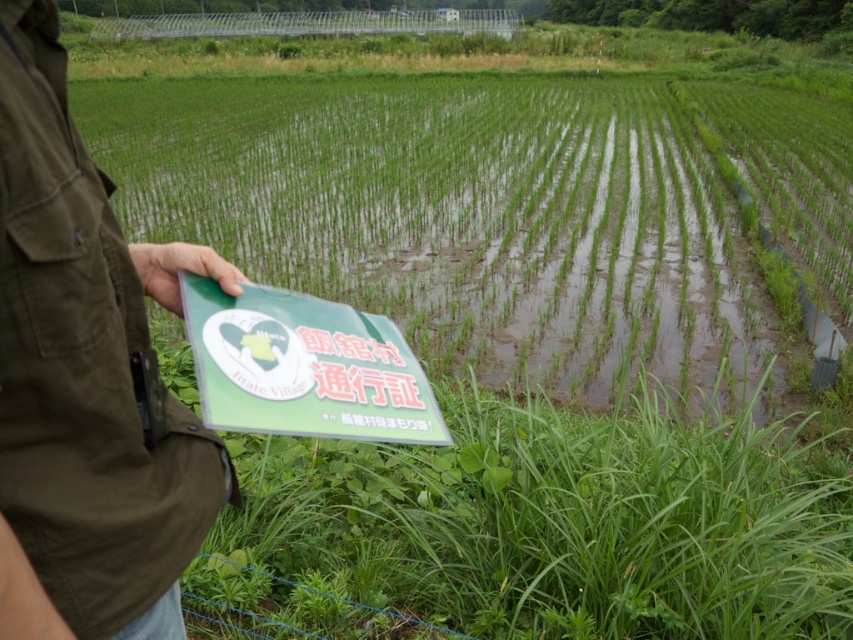
In the scene shown: You are a tourist visiting this rural area and want to take a photo of the green leafy grass at lower center and the green matte folder at left. Which object should you focus on first if you want to capture both in a single frame without moving the camera?

You should focus on the green matte folder at left first because it is on the left side, so capturing it first ensures both objects are in the frame when positioned properly.

You are a tourist visiting this rural area and want to take a photo of the green leafy grass at lower center and the green matte folder at left. Which object should you focus on first to ensure both are in clear view?

You should focus on the green leafy grass at lower center first because it is closer to you than the green matte folder at left, so focusing on it will keep both objects in clear view.